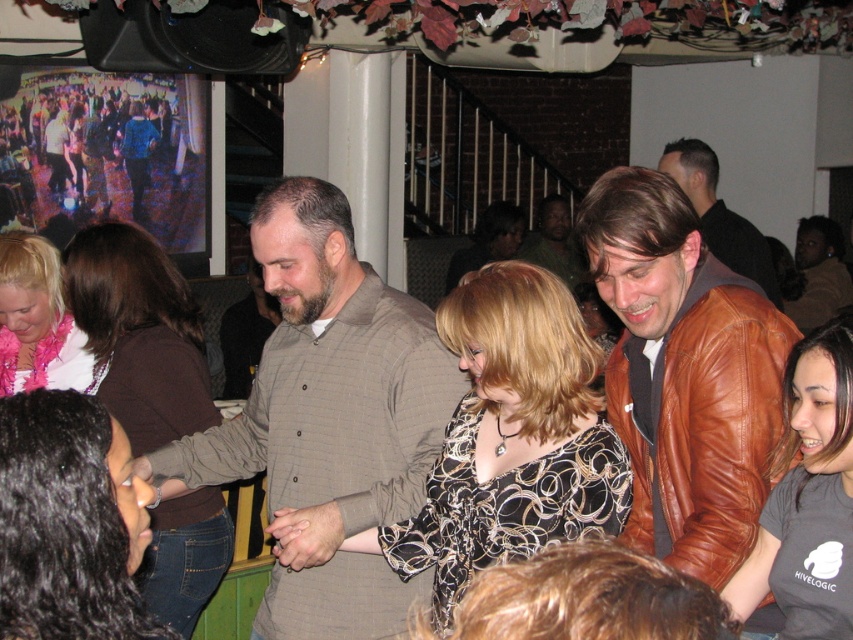
You are standing at the entrance of the bar and want to move towards the two points marked in the image. Which point, point (804, 468) or point (35, 307), is closer to you?

Point (804, 468) is closer to the viewer than point (35, 307), so you should head towards point (804, 468) first.